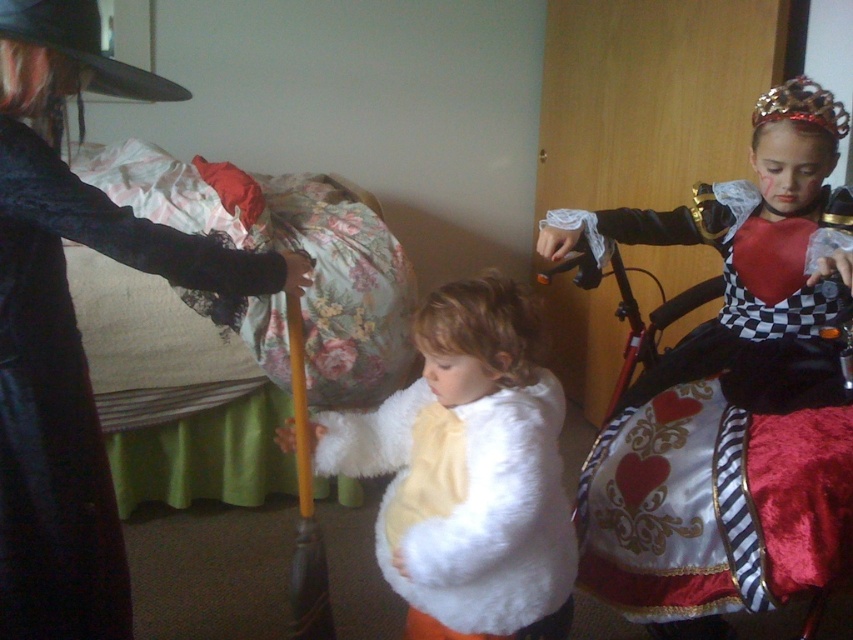
Question: Observing the image, what is the correct spatial positioning of silky red dress at center in reference to white fluffy vest at center?

Choices:
 (A) left
 (B) right

Answer: (B)

Question: Which object is positioned farthest from the matte black coat at left?

Choices:
 (A) silky red dress at center
 (B) white fluffy vest at center

Answer: (A)

Question: Which point is farther to the camera?

Choices:
 (A) (567, 576)
 (B) (843, 192)

Answer: (B)

Question: In this image, where is matte black coat at left located relative to white fluffy vest at center?

Choices:
 (A) right
 (B) left

Answer: (B)

Question: Estimate the real-world distances between objects in this image. Which object is farther from the white fluffy vest at center?

Choices:
 (A) matte black coat at left
 (B) silky red dress at center

Answer: (A)

Question: Is silky red dress at center closer to the viewer compared to white fluffy vest at center?

Choices:
 (A) no
 (B) yes

Answer: (A)